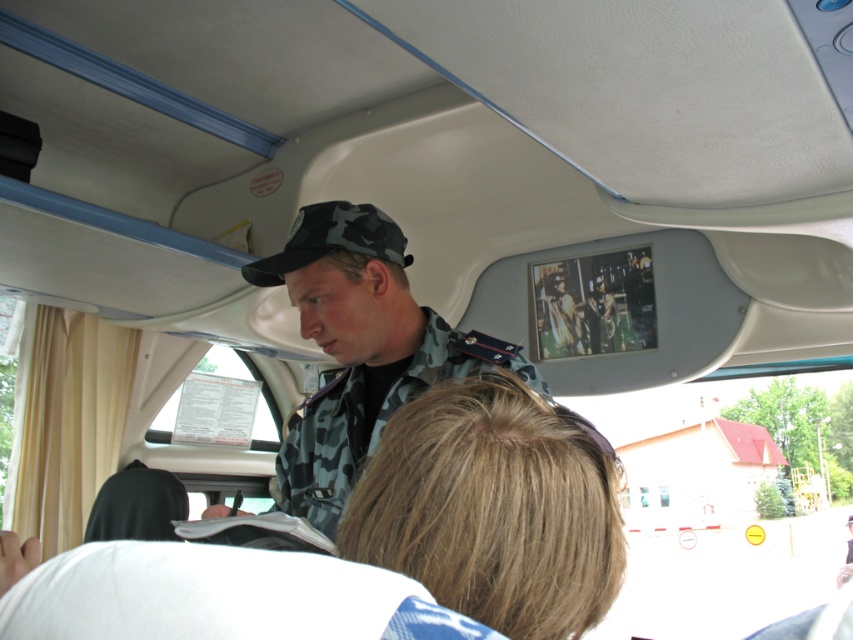
Question: Is white fabric at lower center below camouflage uniform at center?

Choices:
 (A) yes
 (B) no

Answer: (B)

Question: Which point appears closest to the camera in this image?

Choices:
 (A) (317, 240)
 (B) (12, 632)
 (C) (401, 260)

Answer: (B)

Question: Can you confirm if white fabric at lower center is thinner than camouflage fabric baseball cap at upper center?

Choices:
 (A) yes
 (B) no

Answer: (A)

Question: Among these objects, which one is farthest from the camera?

Choices:
 (A) white fabric at lower center
 (B) camouflage uniform at center

Answer: (B)

Question: Which point is farther to the camera?

Choices:
 (A) white fabric at lower center
 (B) camouflage uniform at center
 (C) camouflage fabric baseball cap at upper center

Answer: (C)

Question: Can you confirm if white fabric at lower center is thinner than camouflage fabric baseball cap at upper center?

Choices:
 (A) yes
 (B) no

Answer: (A)